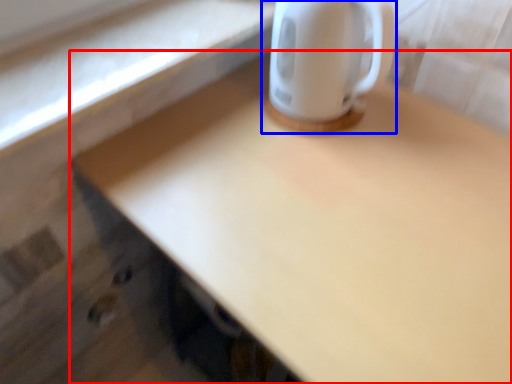
Question: Which object is closer to the camera taking this photo, desk (highlighted by a red box) or coffee cup (highlighted by a blue box)?

Choices:
 (A) desk
 (B) coffee cup

Answer: (A)